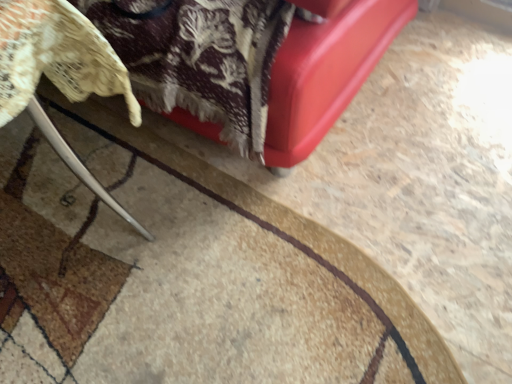
Question: Based on their positions, is carpeted mat at lower left located to the left or right of metallic silver chair at lower left?

Choices:
 (A) right
 (B) left

Answer: (A)

Question: Is carpeted mat at lower left inside the boundaries of metallic silver chair at lower left, or outside?

Choices:
 (A) inside
 (B) outside

Answer: (B)

Question: Is point (130, 177) positioned closer to the camera than point (70, 9)?

Choices:
 (A) closer
 (B) farther

Answer: (B)

Question: From the image's perspective, is metallic silver chair at lower left positioned above or below carpeted mat at lower left?

Choices:
 (A) below
 (B) above

Answer: (B)

Question: Choose the correct answer: Is metallic silver chair at lower left inside carpeted mat at lower left or outside it?

Choices:
 (A) inside
 (B) outside

Answer: (B)

Question: Considering the positions of point (7, 105) and point (243, 357), is point (7, 105) closer or farther from the camera than point (243, 357)?

Choices:
 (A) farther
 (B) closer

Answer: (B)

Question: From a real-world perspective, is metallic silver chair at lower left above or below carpeted mat at lower left?

Choices:
 (A) above
 (B) below

Answer: (A)